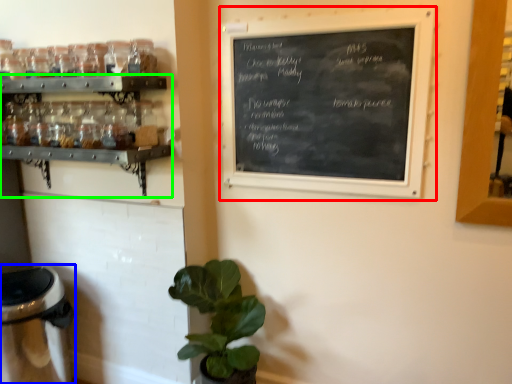
Question: Estimate the real-world distances between objects in this image. Which object is closer to bulletin board (highlighted by a red box), appliance (highlighted by a blue box) or shelf (highlighted by a green box)?

Choices:
 (A) appliance
 (B) shelf

Answer: (B)